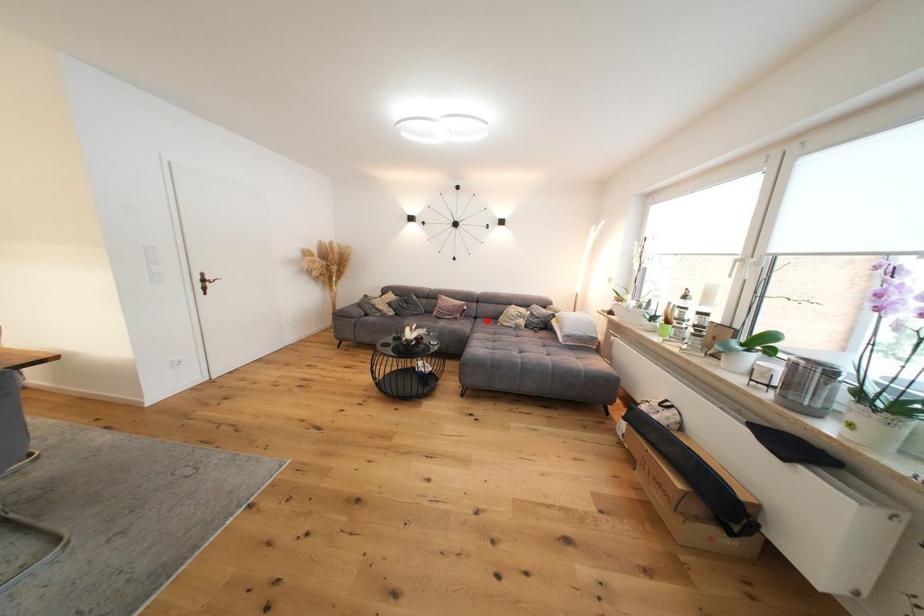
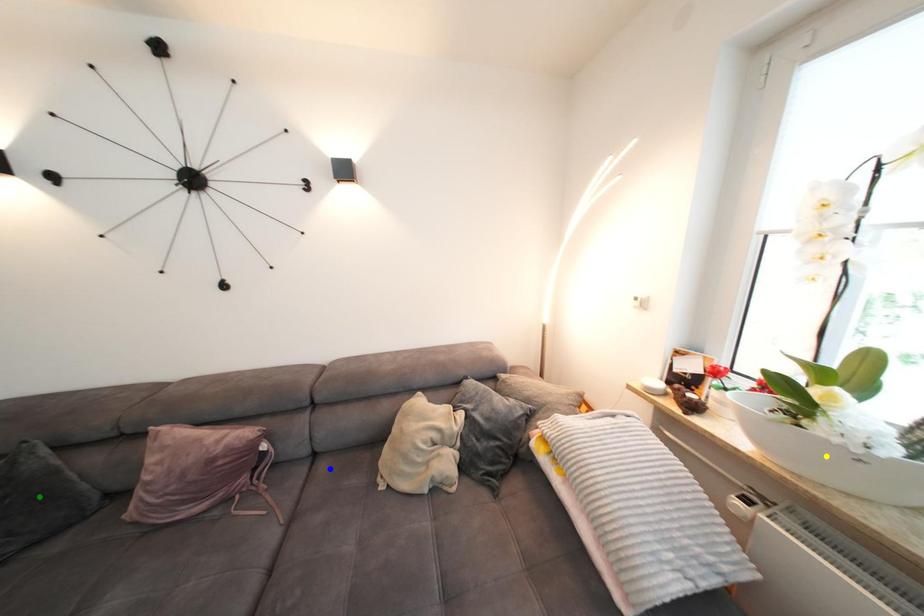
Question: I am providing you with two images of the same scene from different viewpoints. A red point is marked on the first image. You are given multiple points on the second image. Which mark in image 2 goes with the point in image 1?

Choices:
 (A) green point
 (B) blue point
 (C) yellow point

Answer: (B)